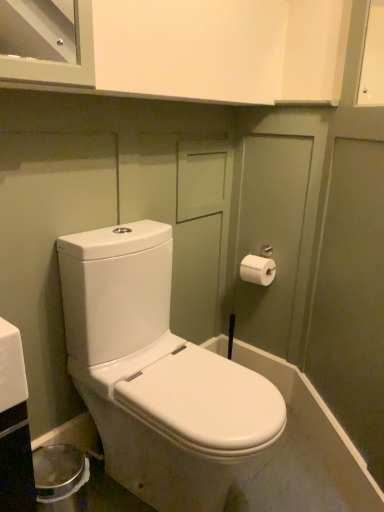
This screenshot has width=384, height=512. Describe the element at coordinates (156, 374) in the screenshot. I see `white glossy toilet at center` at that location.

What is the approximate width of white glossy toilet at center?

It is 24.38 inches.

The width and height of the screenshot is (384, 512). Identify the location of white glossy toilet at center. (156, 374).

Where is `white matte toilet paper at right`? This screenshot has height=512, width=384. white matte toilet paper at right is located at coordinates (257, 270).

The height and width of the screenshot is (512, 384). What do you see at coordinates (257, 270) in the screenshot?
I see `white matte toilet paper at right` at bounding box center [257, 270].

This screenshot has height=512, width=384. In order to click on white glossy toilet at center in this screenshot , I will do `click(156, 374)`.

Does white glossy toilet at center appear on the right side of white matte toilet paper at right?

In fact, white glossy toilet at center is to the left of white matte toilet paper at right.

Is white glossy toilet at center positioned in front of white matte toilet paper at right?

Yes.

Is point (157, 263) farther from camera compared to point (253, 264)?

No, (157, 263) is in front of (253, 264).

From the image's perspective, which one is positioned higher, white glossy toilet at center or white matte toilet paper at right?

white matte toilet paper at right, from the image's perspective.

From a real-world perspective, which is physically below, white glossy toilet at center or white matte toilet paper at right?

white glossy toilet at center, from a real-world perspective.

Does white glossy toilet at center have a greater width compared to white matte toilet paper at right?

Indeed, white glossy toilet at center has a greater width compared to white matte toilet paper at right.

Can you confirm if white glossy toilet at center is taller than white matte toilet paper at right?

Correct, white glossy toilet at center is much taller as white matte toilet paper at right.

Is white glossy toilet at center bigger than white matte toilet paper at right?

Yes.

Is white glossy toilet at center spatially inside white matte toilet paper at right, or outside of it?

white glossy toilet at center is not enclosed by white matte toilet paper at right.

Is white glossy toilet at center far away from white matte toilet paper at right?

No.

Is white glossy toilet at center looking in the opposite direction of white matte toilet paper at right?

No, white glossy toilet at center is not facing the opposite direction of white matte toilet paper at right.

How different are the orientations of white glossy toilet at center and white matte toilet paper at right in degrees?

89.5 degrees separate the facing orientations of white glossy toilet at center and white matte toilet paper at right.

Measure the distance from white glossy toilet at center to white matte toilet paper at right.

They are 26.48 inches apart.

Where is `toilet that is in front of the white matte toilet paper at right`? The height and width of the screenshot is (512, 384). toilet that is in front of the white matte toilet paper at right is located at coordinates (156, 374).

Which is more to the left, white matte toilet paper at right or white glossy toilet at center?

Positioned to the left is white glossy toilet at center.

Considering the positions of objects white matte toilet paper at right and white glossy toilet at center in the image provided, who is behind, white matte toilet paper at right or white glossy toilet at center?

white matte toilet paper at right is behind.

Considering the points (248, 264) and (285, 410), which point is behind, point (248, 264) or point (285, 410)?

Point (248, 264)

From the image's perspective, which object appears higher, white matte toilet paper at right or white glossy toilet at center?

white matte toilet paper at right is shown above in the image.

In the scene shown: From a real-world perspective, is white matte toilet paper at right located higher than white glossy toilet at center?

Yes.

Considering the relative sizes of white matte toilet paper at right and white glossy toilet at center in the image provided, is white matte toilet paper at right wider than white glossy toilet at center?

Incorrect, the width of white matte toilet paper at right does not surpass that of white glossy toilet at center.

Is white matte toilet paper at right shorter than white glossy toilet at center?

Correct, white matte toilet paper at right is not as tall as white glossy toilet at center.

Considering the sizes of objects white matte toilet paper at right and white glossy toilet at center in the image provided, who is smaller, white matte toilet paper at right or white glossy toilet at center?

With smaller size is white matte toilet paper at right.

Which is correct: white matte toilet paper at right is inside white glossy toilet at center, or outside of it?

white matte toilet paper at right is spatially situated outside white glossy toilet at center.

Would you consider white matte toilet paper at right to be distant from white glossy toilet at center?

No, white matte toilet paper at right is not far from white glossy toilet at center.

Is white matte toilet paper at right oriented away from white glossy toilet at center?

No, white matte toilet paper at right is not facing the opposite direction of white glossy toilet at center.

What's the angular difference between white matte toilet paper at right and white glossy toilet at center's facing directions?

The facing directions of white matte toilet paper at right and white glossy toilet at center are 89.5 degrees apart.

Where is `toilet paper lying on the right of white glossy toilet at center`? This screenshot has height=512, width=384. toilet paper lying on the right of white glossy toilet at center is located at coordinates (257, 270).

Find the location of a particular element. toilet on the left of white matte toilet paper at right is located at coordinates click(x=156, y=374).

You are a GUI agent. You are given a task and a screenshot of the screen. Output one action in this format:
    pyautogui.click(x=<x>, y=<y>)
    Task: Click on the toilet below the white matte toilet paper at right (from the image's perspective)
    
    Given the screenshot: What is the action you would take?
    pyautogui.click(x=156, y=374)